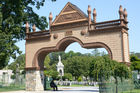
Identify the location of entrance way. tap(37, 46).